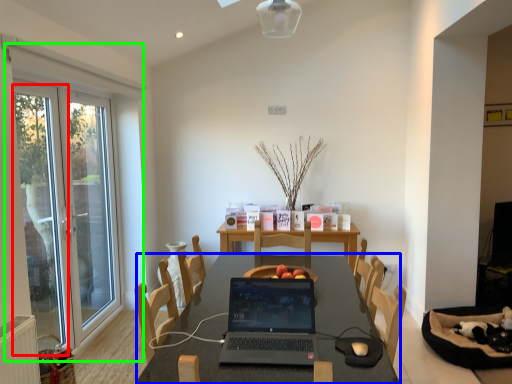
Question: Which object is positioned farthest from screen door (highlighted by a red box)? Select from table (highlighted by a blue box) and window (highlighted by a green box).

Choices:
 (A) table
 (B) window

Answer: (A)